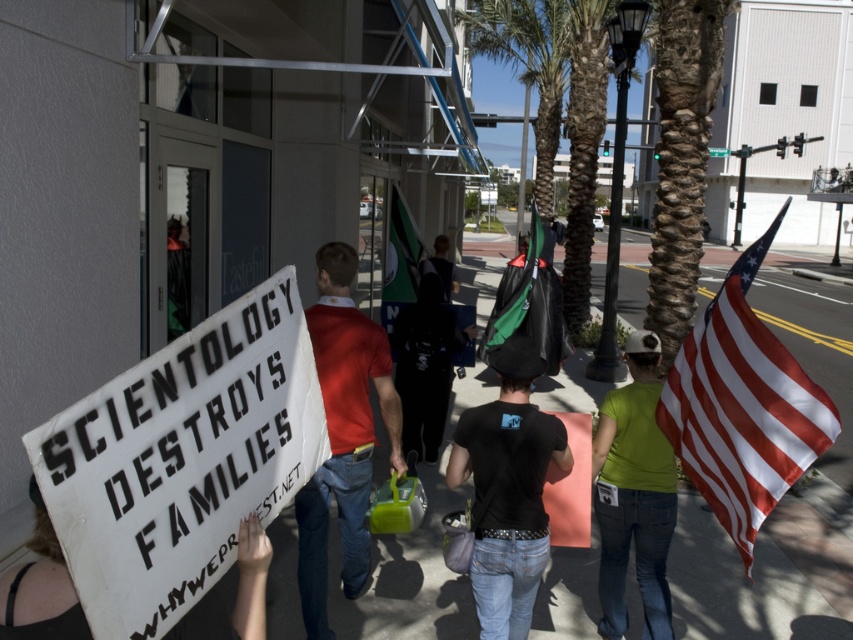
Question: Is matte red t-shirt at center positioned before green fabric shirt at center?

Choices:
 (A) no
 (B) yes

Answer: (A)

Question: Among these points, which one is nearest to the camera?

Choices:
 (A) (337, 291)
 (B) (659, 548)

Answer: (A)

Question: Does red-white striped fabric flag at right have a smaller size compared to white cardboard sign at lower left?

Choices:
 (A) no
 (B) yes

Answer: (A)

Question: Considering the real-world distances, which object is farthest from the matte red t-shirt at center?

Choices:
 (A) green fabric shirt at center
 (B) white cardboard sign at lower left
 (C) red-white striped fabric flag at right
 (D) green fabric flag at center

Answer: (D)

Question: Estimate the real-world distances between objects in this image. Which object is closer to the black matte t-shirt at center?

Choices:
 (A) matte red t-shirt at center
 (B) red-white striped fabric flag at right
 (C) green fabric shirt at center

Answer: (C)

Question: Does red-white striped fabric flag at right have a greater width compared to black matte t-shirt at center?

Choices:
 (A) yes
 (B) no

Answer: (B)